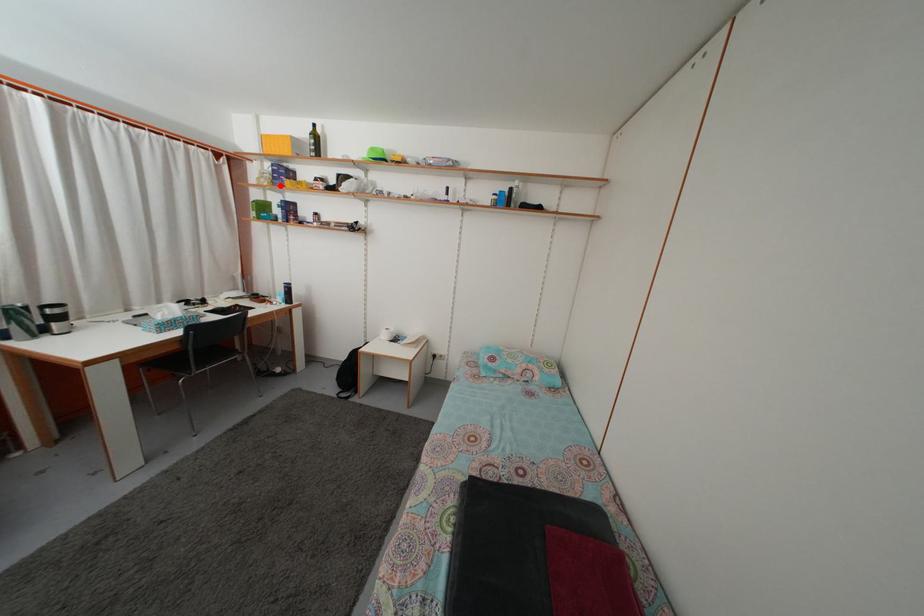
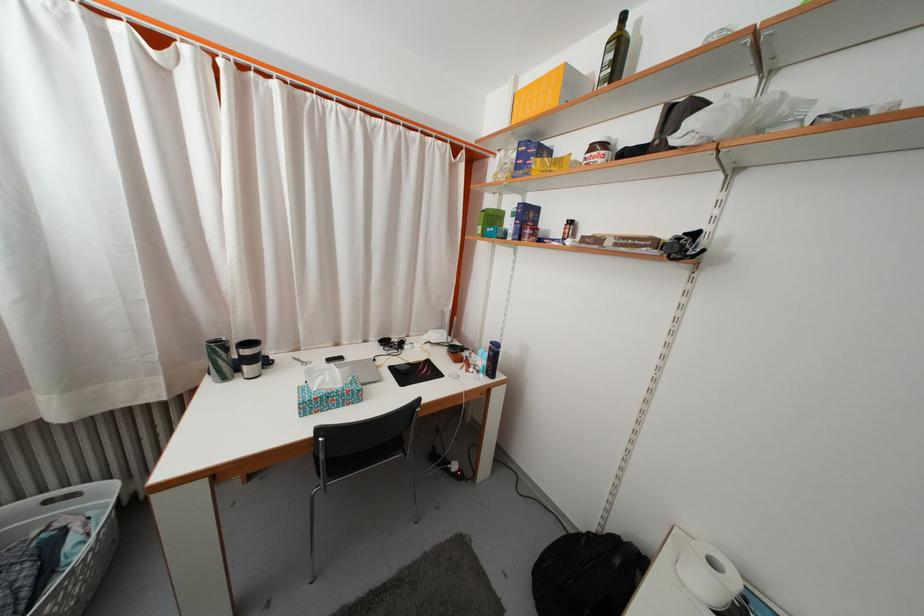
The point at the highlighted location is marked in the first image. Where is the corresponding point in the second image?

(523, 175)